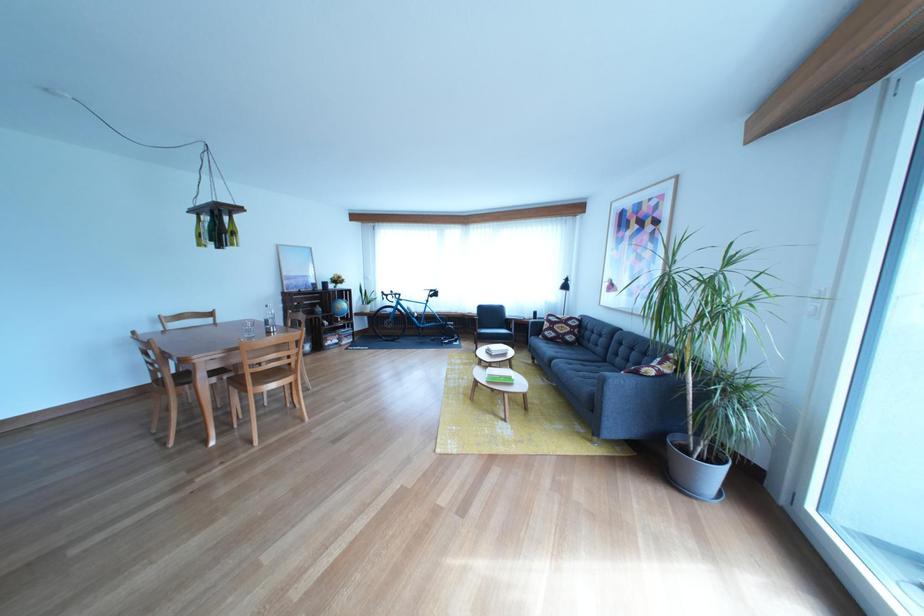
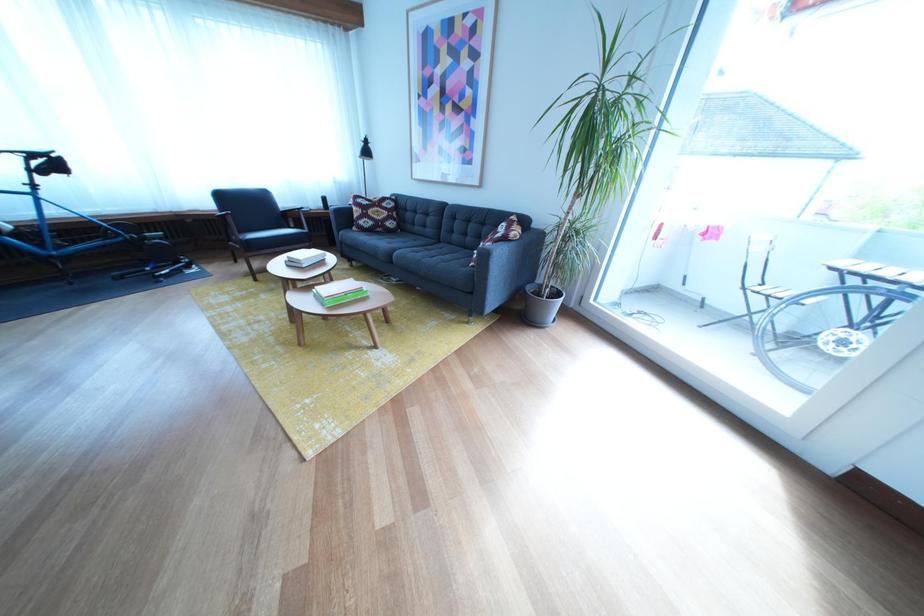
The point at (572, 333) is marked in the first image. Where is the corresponding point in the second image?

(386, 219)